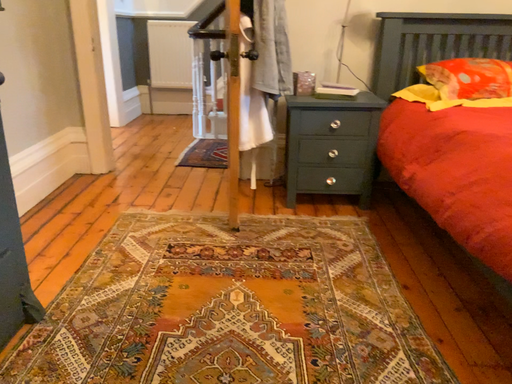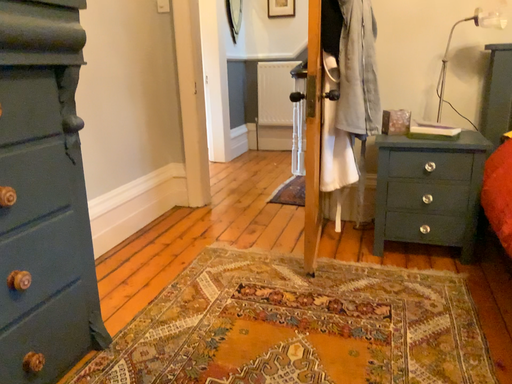
Question: Which way did the camera rotate in the video?

Choices:
 (A) rotated left
 (B) rotated right

Answer: (A)